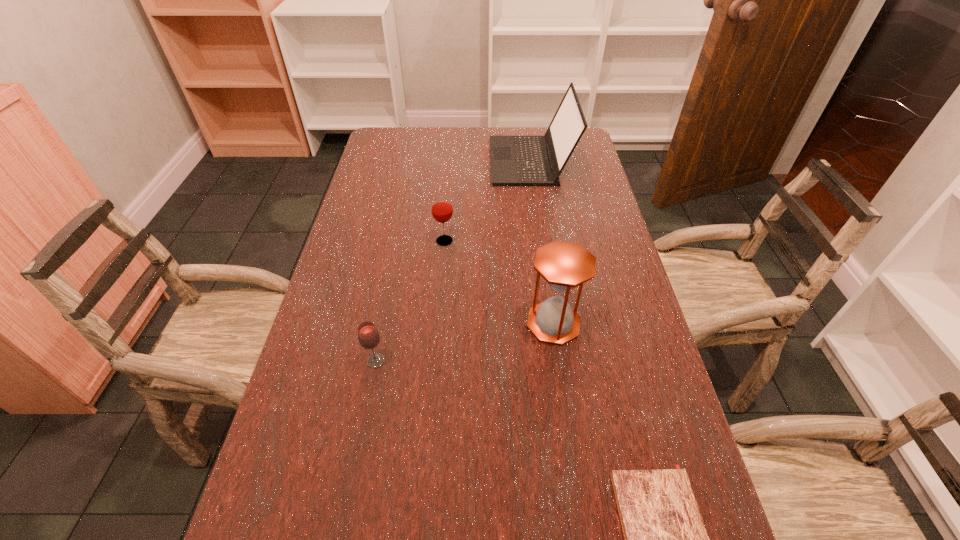
Where is `empty space between the third nearest object and the farther glass drink container`? empty space between the third nearest object and the farther glass drink container is located at coordinates (499, 282).

Locate an element on the screen. The height and width of the screenshot is (540, 960). the closest object to the fourth nearest object is located at coordinates (515, 160).

Identify which object is the closest to the farther glass drink container. Please provide its 2D coordinates. Your answer should be formatted as a tuple, i.e. [(x, y)], where the tuple contains the x and y coordinates of a point satisfying the conditions above.

[(515, 160)]

Where is `vacant area that satisfies the following two spatial constraints: 1. on the surface of the laptop; 2. on the front side of the shorter glass drink container`? The image size is (960, 540). vacant area that satisfies the following two spatial constraints: 1. on the surface of the laptop; 2. on the front side of the shorter glass drink container is located at coordinates (560, 361).